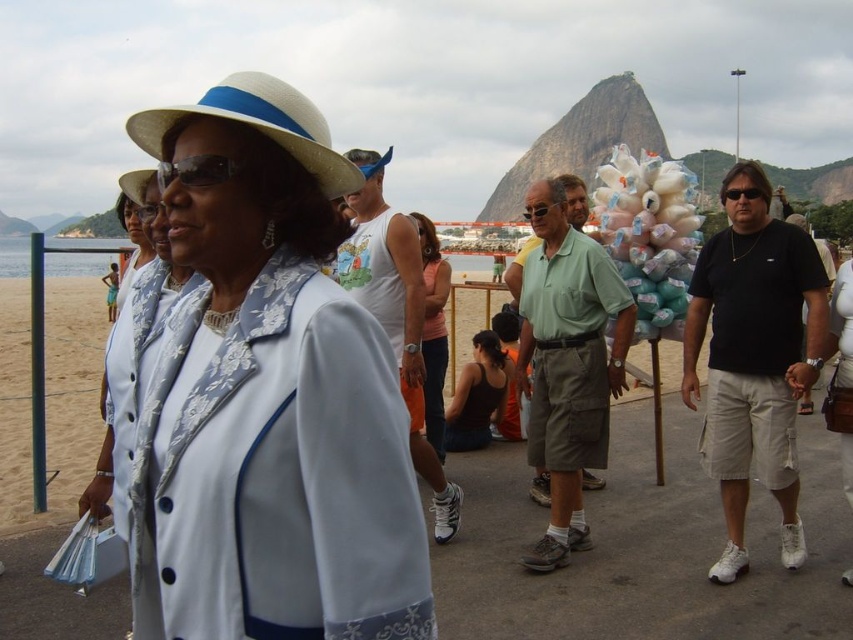
Looking at this image, you are a photographer trying to capture a candid shot of the two people in the center wearing the white fabric at center and orange fabric tank top at center. Since you want to ensure both subjects are fully visible in the frame, which fabric is shorter and might require adjusting your angle to avoid cropping?

The white fabric at center is shorter than the orange fabric tank top at center, so you should adjust your angle to ensure the shorter white fabric at center is fully visible without being cut off.